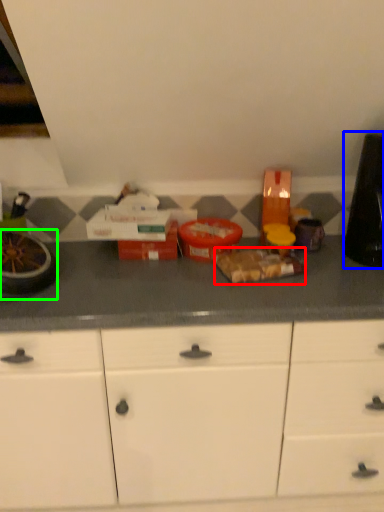
Question: Considering the real-world distances, which object is closest to food (highlighted by a red box)? appliance (highlighted by a blue box) or appliance (highlighted by a green box).

Choices:
 (A) appliance
 (B) appliance

Answer: (A)